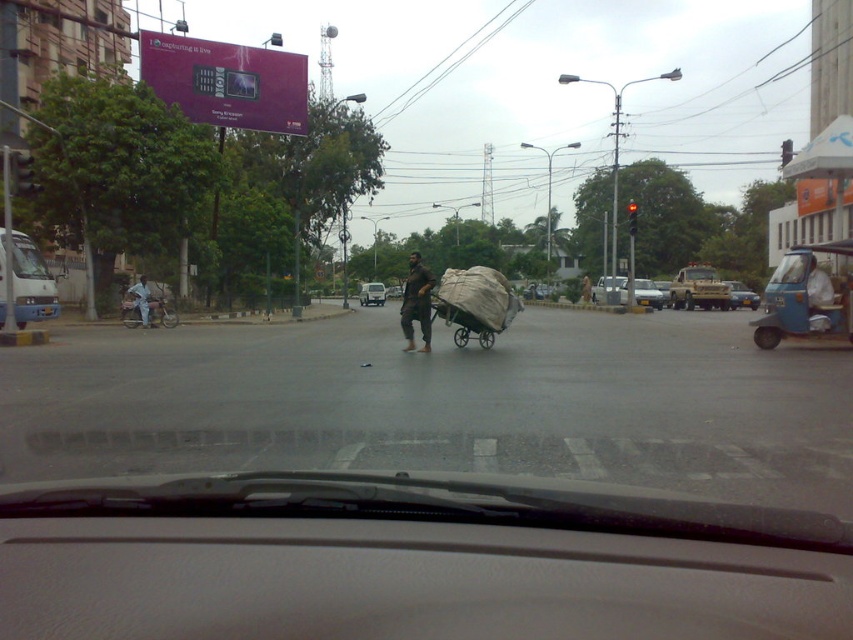
Who is positioned more to the right, dark brown fabric at center or dark brown leather jacket at center?

From the viewer's perspective, dark brown leather jacket at center appears more on the right side.

Based on the photo, who is more distant from viewer, (419,266) or (589,298)?

The point (589,298) is more distant.

I want to click on dark brown fabric at center, so 416,301.

Does green fabric cart at center have a lesser height compared to camouflage fabric truck at center?

Indeed, green fabric cart at center has a lesser height compared to camouflage fabric truck at center.

Between point (445, 323) and point (726, 289), which one is positioned behind?

Point (726, 289)

Which is in front, point (466, 276) or point (711, 275)?

Point (466, 276)

Identify the location of green fabric cart at center. This screenshot has height=640, width=853. (474, 304).

Is point (682, 298) positioned in front of point (730, 288)?

Yes, point (682, 298) is in front of point (730, 288).

Between point (679, 273) and point (737, 282), which one is positioned in front?

Point (679, 273) is more forward.

Which is behind, point (682, 292) or point (757, 305)?

The point (757, 305) is behind.

You are a GUI agent. You are given a task and a screenshot of the screen. Output one action in this format:
    pyautogui.click(x=<x>, y=<y>)
    Task: Click on the camouflage fabric truck at center
    This screenshot has width=853, height=640.
    Given the screenshot: What is the action you would take?
    pyautogui.click(x=698, y=289)